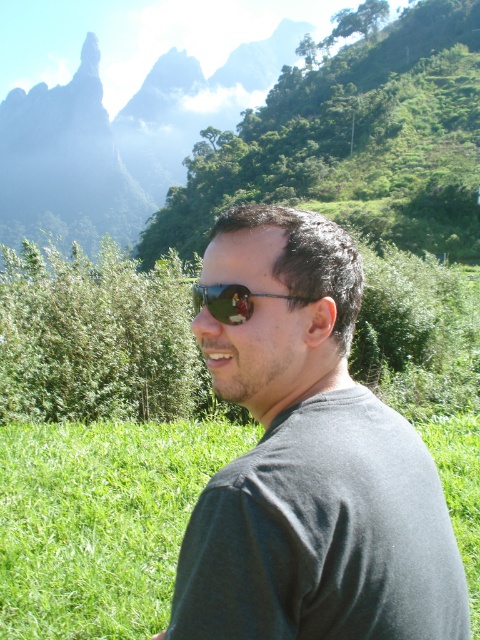
Question: Which point is closer to the camera taking this photo?

Choices:
 (A) (220, 305)
 (B) (335, 333)
 (C) (133, 433)

Answer: (A)

Question: Can you confirm if dark gray t-shirt at center is smaller than green grassy at center?

Choices:
 (A) yes
 (B) no

Answer: (B)

Question: Is green grassy at center above sunglasses at center?

Choices:
 (A) no
 (B) yes

Answer: (A)

Question: Estimate the real-world distances between objects in this image. Which object is farther from the sunglasses at center?

Choices:
 (A) green grassy at center
 (B) dark gray t-shirt at center

Answer: (A)

Question: Which object is the farthest from the dark gray t-shirt at center?

Choices:
 (A) green grassy at center
 (B) sunglasses at center

Answer: (B)

Question: Considering the relative positions of green grassy at center and sunglasses at center in the image provided, where is green grassy at center located with respect to sunglasses at center?

Choices:
 (A) below
 (B) above

Answer: (A)